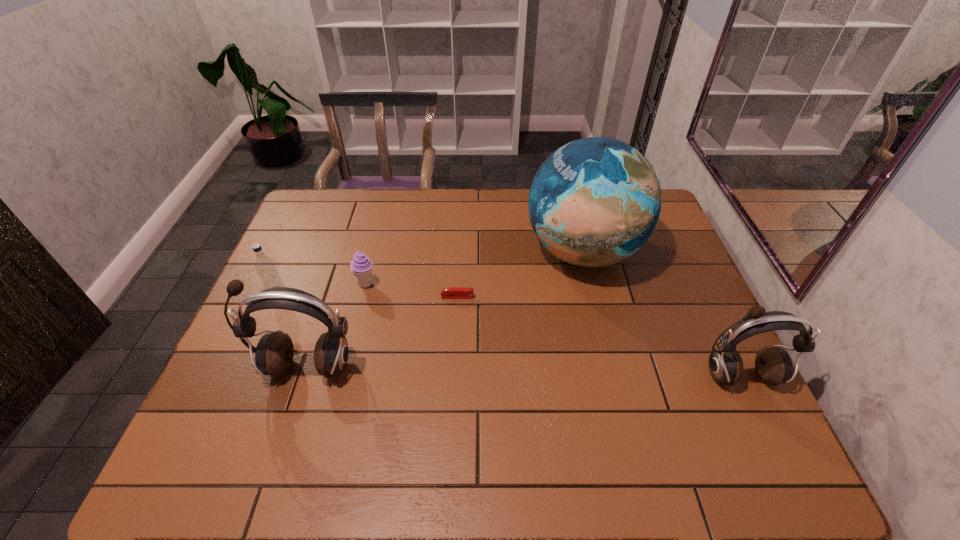
If the aim is uniform spacing by inserting an additional earphone among them, please point to a vacant space for this new earphone. Please provide its 2D coordinates. Your answer should be formatted as a tuple, i.e. [(x, y)], where the tuple contains the x and y coordinates of a point satisfying the conditions above.

[(521, 372)]